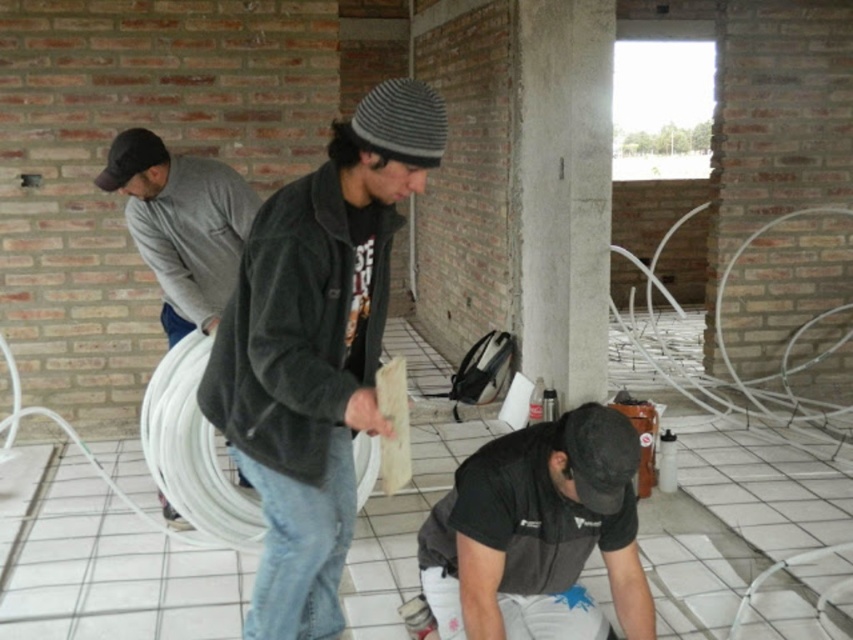
You are an observer standing in the construction site. You see the dark gray fleece jacket at center and the black matte shirt at lower center. Which of these two items is smaller in size?

The dark gray fleece jacket at center is smaller than the black matte shirt at lower center.

You are a safety inspector at the construction site and need to check the jackets of the workers. Which jacket is closer to you, the dark gray corduroy jacket at center or the dark gray fleece jacket at center?

The dark gray corduroy jacket at center is closer to you because it is further to the viewer than the dark gray fleece jacket at center.